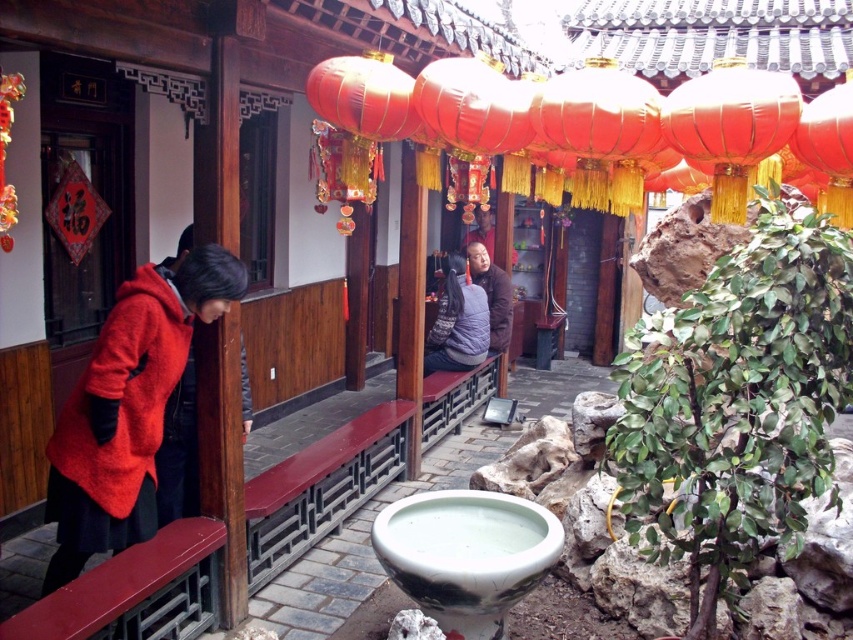
Can you confirm if matte red coat at left is taller than knitted sweater at center?

No, matte red coat at left is not taller than knitted sweater at center.

Is point (175, 364) less distant than point (448, 369)?

Yes.

The height and width of the screenshot is (640, 853). Describe the element at coordinates (123, 394) in the screenshot. I see `matte red coat at left` at that location.

The height and width of the screenshot is (640, 853). Identify the location of matte red coat at left. (123, 394).

Is the position of matte red coat at left more distant than that of porcelain basin at center?

Yes, matte red coat at left is further from the viewer.

Consider the image. Is matte red coat at left above porcelain basin at center?

Correct, matte red coat at left is located above porcelain basin at center.

Is point (105, 369) closer to camera compared to point (426, 525)?

Yes, point (105, 369) is closer to viewer.

Identify the location of matte red coat at left. The image size is (853, 640). (123, 394).

Based on the photo, does porcelain basin at center appear under shiny red lantern at upper right?

Correct, porcelain basin at center is located below shiny red lantern at upper right.

Which is behind, point (506, 552) or point (695, 109)?

Positioned behind is point (506, 552).

Identify the location of porcelain basin at center. (466, 556).